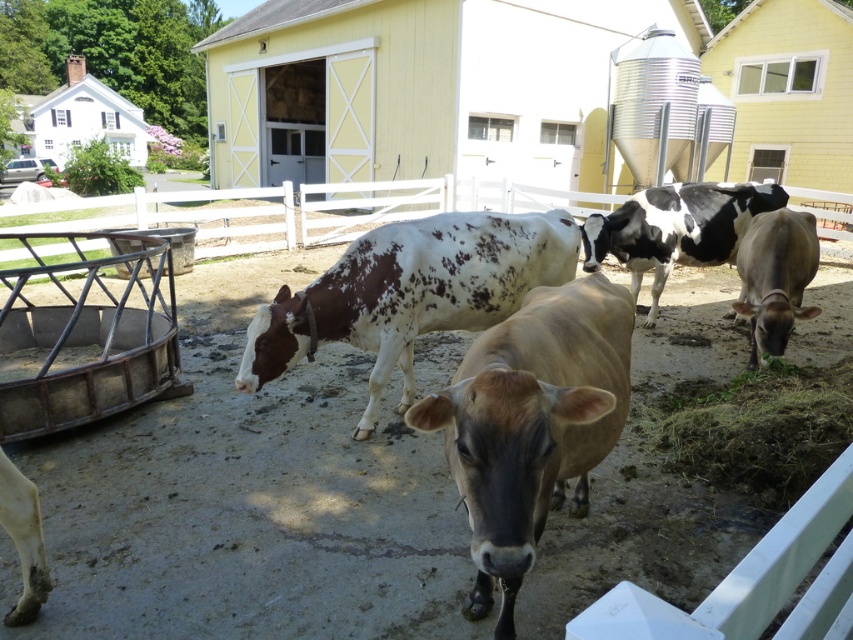
You are a farmer checking the field. You notice the brown glossy cow at center and the white painted wood barn at upper left. Which object is closer to you?

The brown glossy cow at center is closer to you because it is in front of the white painted wood barn at upper left.

You are standing in the farm scene and want to reach the point marked at coordinates (527, 525). How far will you have to walk to get there?

The point at coordinates (527, 525) is 4.95 feet away from the viewer, so you will have to walk approximately 4.95 feet to reach it.